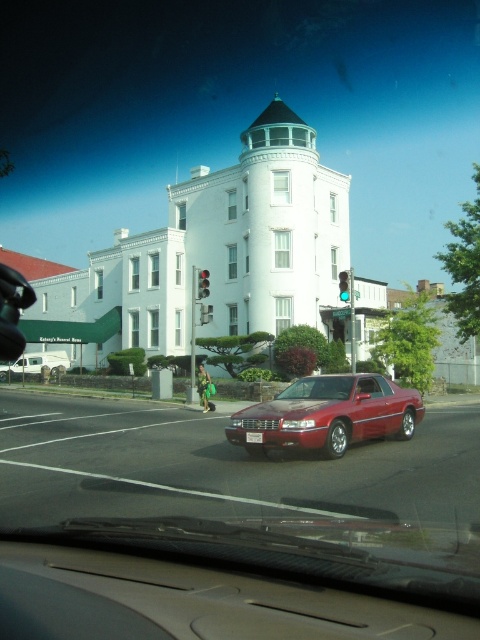
You are driving a car and see the image. There is a point marked at coordinates (327,413). What object does this point mark?

The point marks the glossy red car at center.

You are a passenger in the vehicle and want to know which object is nearer to you between the glossy red car at center and the red glass traffic light at center. Which one is closer?

The glossy red car at center is closer to the viewer than the red glass traffic light at center.